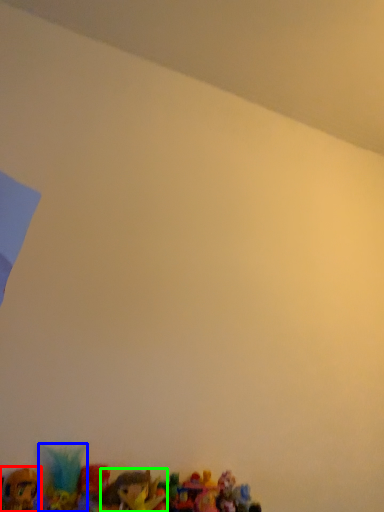
Question: Which object is positioned closest to toy (highlighted by a red box)? Select from toy (highlighted by a blue box) and toy (highlighted by a green box).

Choices:
 (A) toy
 (B) toy

Answer: (A)